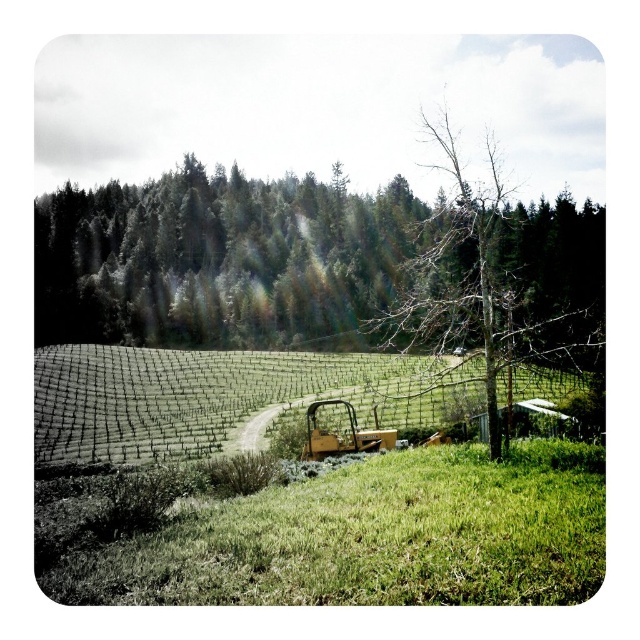
Question: Which point is farther from the camera taking this photo?

Choices:
 (A) (403, 342)
 (B) (148, 371)
 (C) (269, 595)
 (D) (154, 326)

Answer: (D)

Question: Does green leafy tree at upper center have a greater width compared to green grass at lower center?

Choices:
 (A) yes
 (B) no

Answer: (A)

Question: Can you confirm if green grass at lower center is wider than bare wood tree at center?

Choices:
 (A) no
 (B) yes

Answer: (A)

Question: Which point is closer to the camera taking this photo?

Choices:
 (A) (328, 202)
 (B) (604, 339)

Answer: (B)

Question: Which object is positioned farthest from the bare wood tree at center?

Choices:
 (A) green netting at center
 (B) green leafy tree at upper center

Answer: (B)

Question: Observing the image, what is the correct spatial positioning of green leafy tree at upper center in reference to green grass at lower center?

Choices:
 (A) below
 (B) above

Answer: (B)